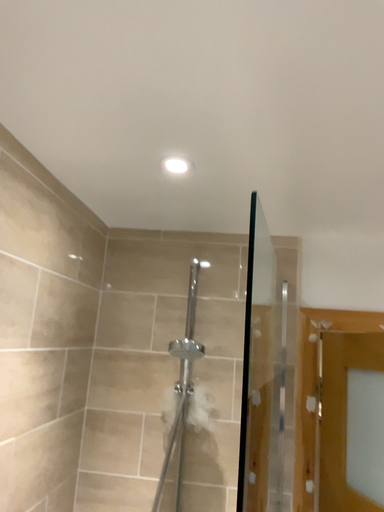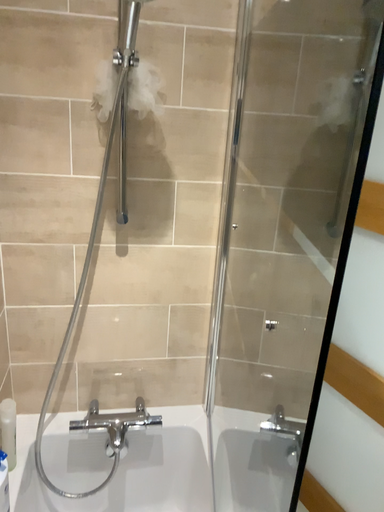
Question: Which way did the camera rotate in the video?

Choices:
 (A) rotated left
 (B) rotated right

Answer: (B)